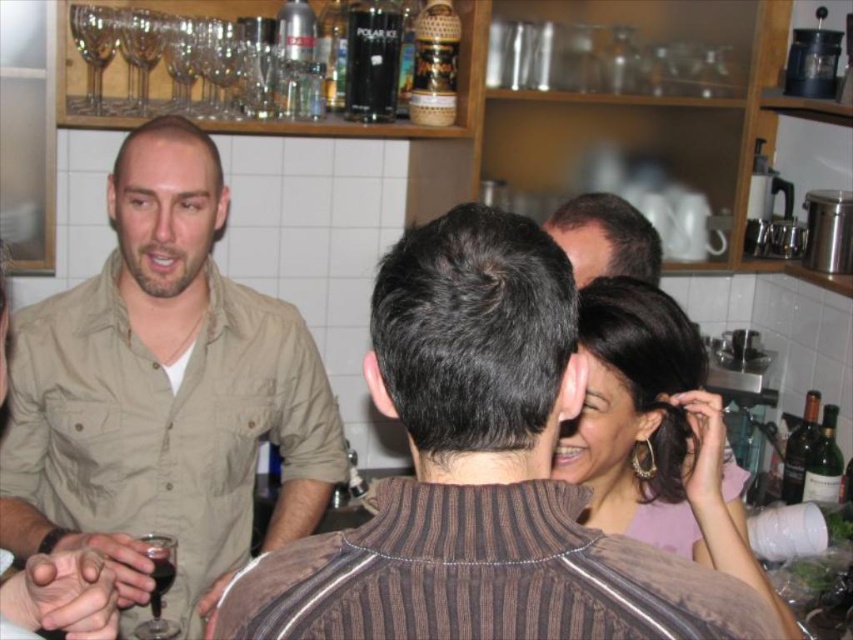
Does point (759, 573) lie behind point (177, 628)?

No, (759, 573) is in front of (177, 628).

Between point (733, 509) and point (160, 557), which one is positioned in front?

Point (733, 509) is in front.

Find the location of a particular element. The height and width of the screenshot is (640, 853). gold hoop earrings at upper right is located at coordinates coord(656,435).

Which is more to the left, black plastic cup at upper center or transparent glass wine at lower left?

Positioned to the left is transparent glass wine at lower left.

This screenshot has width=853, height=640. Identify the location of black plastic cup at upper center. (372, 60).

Between point (399, 40) and point (164, 570), which one is positioned behind?

Positioned behind is point (399, 40).

The image size is (853, 640). I want to click on black plastic cup at upper center, so pos(372,60).

Who is lower down, dark brown hair at upper center or dark red liquid at lower left?

dark red liquid at lower left is below.

Does dark brown hair at upper center have a lesser height compared to dark red liquid at lower left?

No.

Is point (627, 209) positioned before point (146, 552)?

No, (627, 209) is further to viewer.

Where is `dark brown hair at upper center`? dark brown hair at upper center is located at coordinates (605, 237).